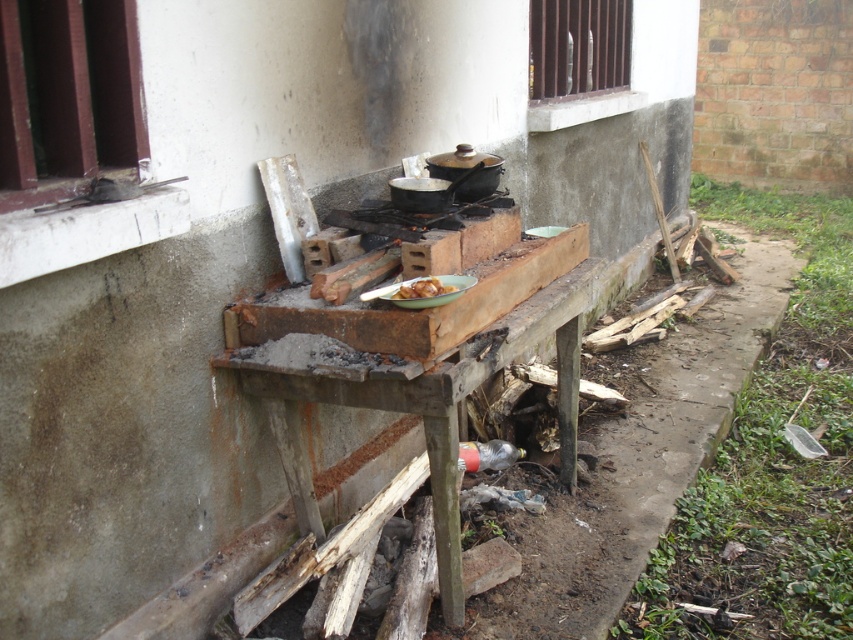
Consider the image. Between rusty wooden table at center and yellow matte plate at center, which one is positioned higher?

yellow matte plate at center is above.

How much distance is there between rusty wooden table at center and yellow matte plate at center?

rusty wooden table at center is 17.40 inches away from yellow matte plate at center.

Which is in front, point (410, 381) or point (418, 276)?

Point (410, 381) is in front.

You are a GUI agent. You are given a task and a screenshot of the screen. Output one action in this format:
    pyautogui.click(x=<x>, y=<y>)
    Task: Click on the rusty wooden table at center
    This screenshot has width=853, height=640.
    Given the screenshot: What is the action you would take?
    pyautogui.click(x=422, y=432)